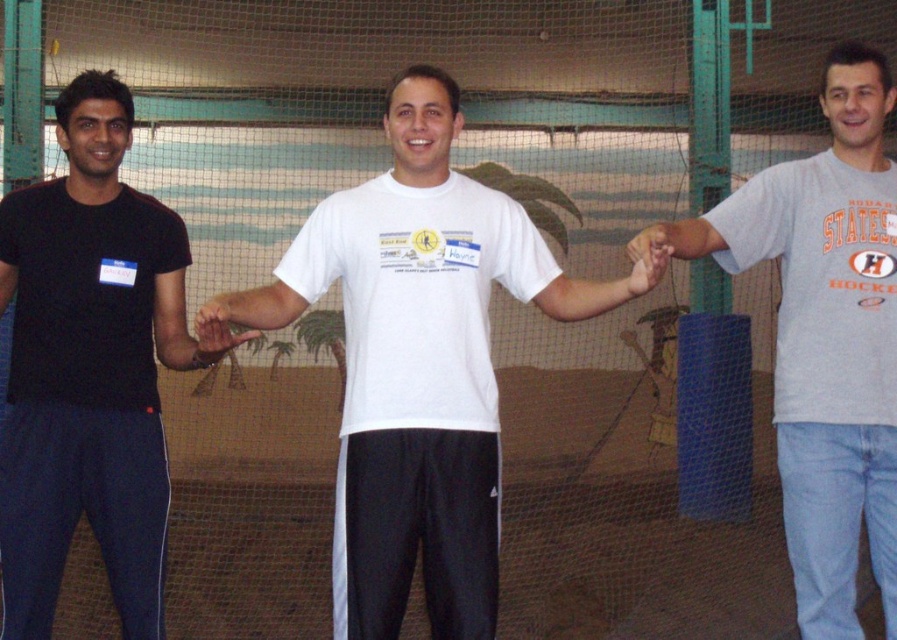
Question: Is white matte t-shirt at center behind matte white hand at center?

Choices:
 (A) yes
 (B) no

Answer: (A)

Question: Which is nearer to the gray cotton t-shirt at right?

Choices:
 (A) black matte t-shirt at left
 (B) white matte t-shirt at center

Answer: (B)

Question: Where is white matte t-shirt at center located in relation to gray cotton t-shirt at right in the image?

Choices:
 (A) right
 (B) left

Answer: (B)

Question: Which of the following is the farthest from the observer?

Choices:
 (A) [x=832, y=236]
 (B) [x=196, y=323]
 (C) [x=100, y=400]

Answer: (C)

Question: Can you confirm if white matte t-shirt at center is positioned to the right of matte white hand at center?

Choices:
 (A) yes
 (B) no

Answer: (A)

Question: Among these objects, which one is nearest to the camera?

Choices:
 (A) white matte t-shirt at center
 (B) black matte t-shirt at left
 (C) matte white hand at center
 (D) gray cotton t-shirt at right

Answer: (C)